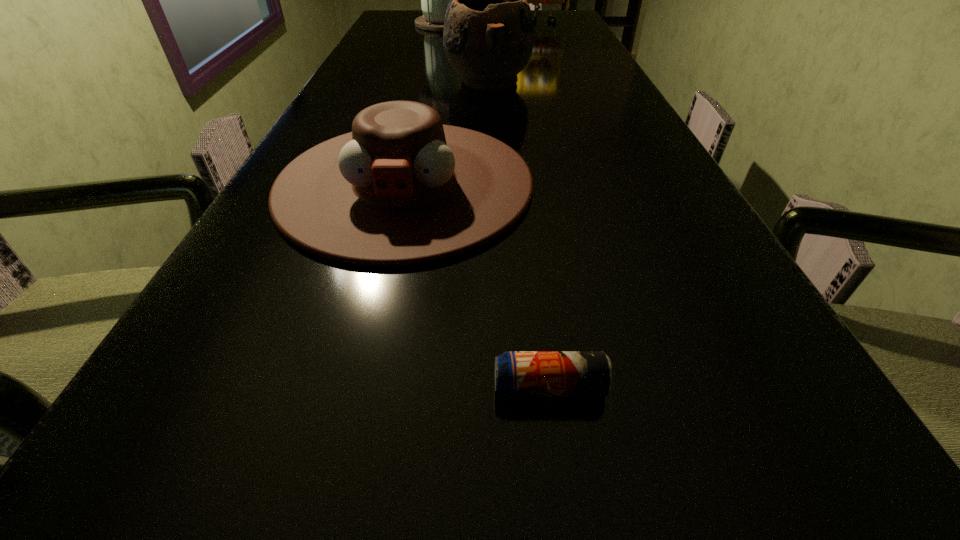
At what (x,y) coordinates should I click in order to perform the action: click on vacant point located on the back of the pottery. Please return your answer as a coordinate pair (x, y). Looking at the image, I should click on (486, 31).

In order to click on vacant space located on the front-facing side of the second shortest object in this screenshot , I will do `click(357, 387)`.

At what (x,y) coordinates should I click in order to perform the action: click on vacant area located 0.050m on the right of the nearest object. Please return your answer as a coordinate pair (x, y). The height and width of the screenshot is (540, 960). Looking at the image, I should click on (649, 387).

Identify the location of lantern present at the far edge. (434, 0).

Find the location of a particular element. The height and width of the screenshot is (540, 960). sponge that is positioned at the far edge is located at coordinates (535, 0).

At what (x,y) coordinates should I click in order to perform the action: click on lantern that is at the left edge. Please return your answer as a coordinate pair (x, y). This screenshot has height=540, width=960. Looking at the image, I should click on (434, 0).

This screenshot has height=540, width=960. What are the coordinates of `cowboy hat that is at the left edge` in the screenshot? It's located at (402, 188).

At what (x,y) coordinates should I click in order to perform the action: click on object situated at the right edge. Please return your answer as a coordinate pair (x, y). The width and height of the screenshot is (960, 540). Looking at the image, I should click on 535,0.

I want to click on object located at the far left corner, so click(434, 0).

Locate an element on the screen. object located at the far right corner is located at coordinates (535, 0).